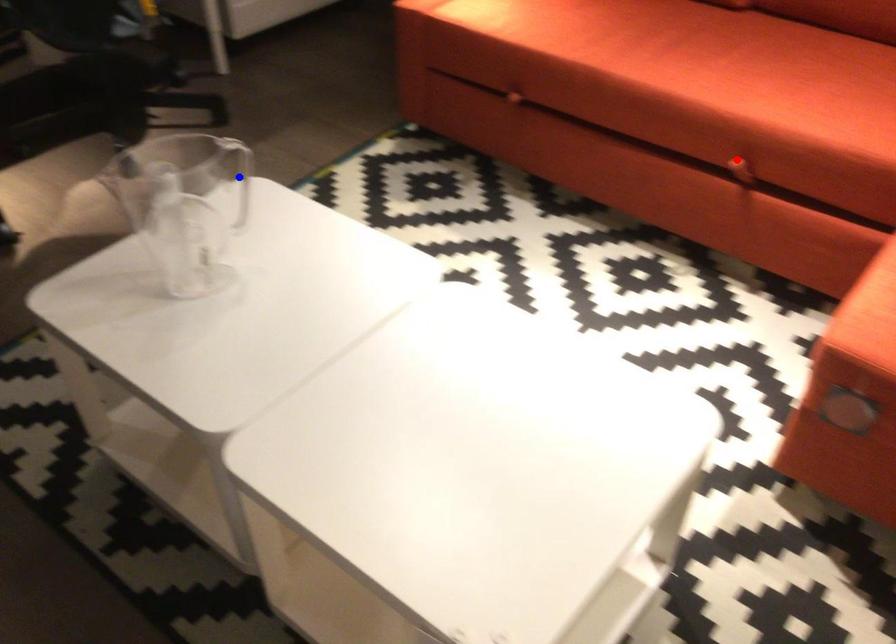
Question: Two points are marked on the image. Which point is closer to the camera?

Choices:
 (A) Blue point is closer.
 (B) Red point is closer.

Answer: (B)